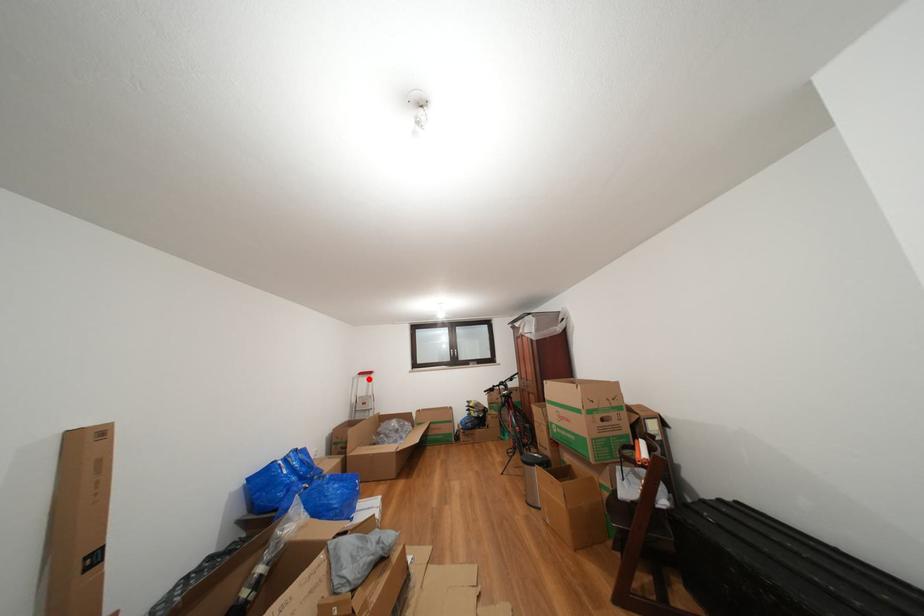
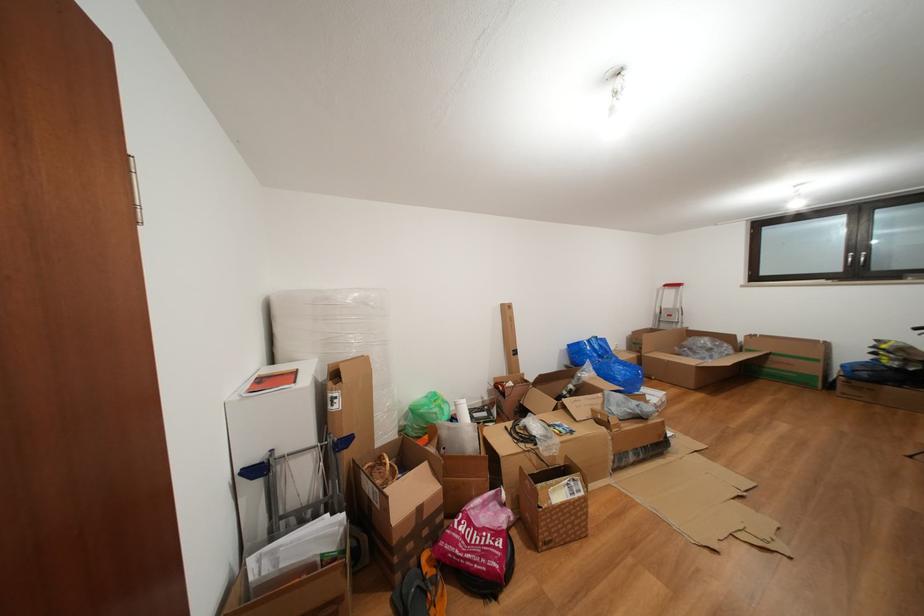
In the second image, find the point that corresponds to the highlighted location in the first image.

(674, 291)